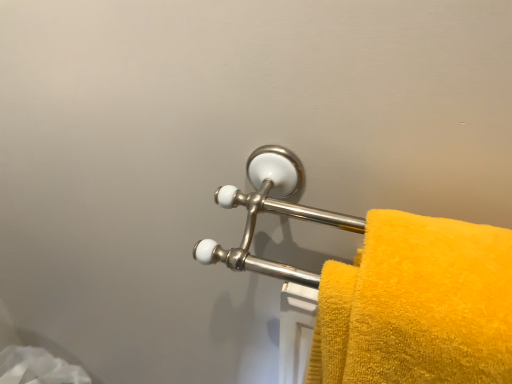
The width and height of the screenshot is (512, 384). Describe the element at coordinates (417, 305) in the screenshot. I see `yellow terry cloth towel at right` at that location.

The width and height of the screenshot is (512, 384). Identify the location of yellow terry cloth towel at right. (417, 305).

Identify the location of yellow terry cloth towel at right. (417, 305).